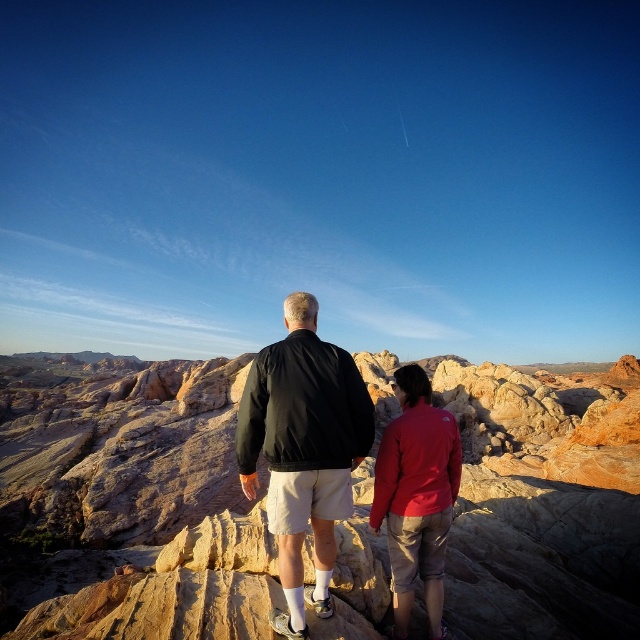
You are planning to place a 10 meter long banner between the black matte jacket at center and the matte red jacket at center. Will the banner fit between them without needing to extend beyond either jacket?

The distance between the black matte jacket at center and the matte red jacket at center is 13.41 meters. Since the banner is 10 meters long, it will fit between them with 3.41 meters of space remaining on either side.

You are a photographer trying to capture both the black matte jacket at center and the matte red jacket at center in a single frame. Since you want to emphasize the size difference between them, which jacket should you position closer to the camera to achieve this effect?

To emphasize the size difference between the black matte jacket at center and the matte red jacket at center, position the black matte jacket at center closer to the camera since it is larger in size, making it appear even bigger in comparison.

You are a photographer wanting to capture both the black matte jacket at center and the matte red jacket at center in a single frame. Since the jackets are layered, which jacket will appear in front in the photo?

The black matte jacket at center is positioned over matte red jacket at center, so it will appear in front in the photo.